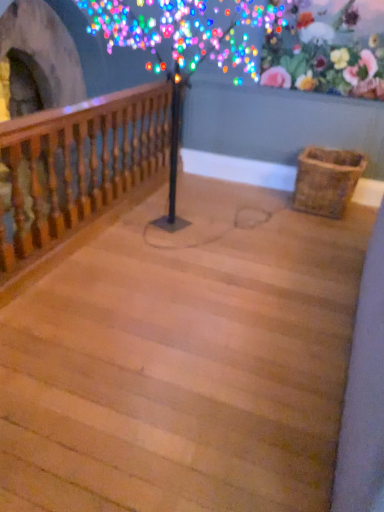
What do you see at coordinates (326, 180) in the screenshot? I see `woven brown basket at lower right` at bounding box center [326, 180].

Describe the element at coordinates (184, 361) in the screenshot. I see `wooden stairs at center` at that location.

What is the approximate height of floral fabric at upper right?

floral fabric at upper right is 70.55 centimeters in height.

This screenshot has width=384, height=512. In order to click on woven brown basket at lower right in this screenshot , I will do `click(326, 180)`.

The height and width of the screenshot is (512, 384). Identify the location of floral arrangement that appears in front of the woven brown basket at lower right. (326, 50).

From a real-world perspective, is woven brown basket at lower right physically above floral fabric at upper right?

No, from a real-world perspective, woven brown basket at lower right is not above floral fabric at upper right.

What's the angular difference between woven brown basket at lower right and floral fabric at upper right's facing directions?

The facing directions of woven brown basket at lower right and floral fabric at upper right are 88.6 degrees apart.

Looking at this image, is woven brown basket at lower right at the left side of floral fabric at upper right?

In fact, woven brown basket at lower right is to the right of floral fabric at upper right.

Would you say woven brown basket at lower right is to the left or to the right of wooden stairs at center in the picture?

In the image, woven brown basket at lower right appears on the right side of wooden stairs at center.

Which of these two, woven brown basket at lower right or wooden stairs at center, stands shorter?

Standing shorter between the two is wooden stairs at center.

Is woven brown basket at lower right oriented away from wooden stairs at center?

No.

How many degrees apart are the facing directions of woven brown basket at lower right and wooden stairs at center?

89.3 degrees.

Is floral fabric at upper right oriented away from wooden baluster at left?

That's not correct — floral fabric at upper right is not looking away from wooden baluster at left.

In terms of height, does floral fabric at upper right look taller or shorter compared to wooden baluster at left?

In the image, floral fabric at upper right appears to be shorter than wooden baluster at left.

The image size is (384, 512). In order to click on rail in front of the floral fabric at upper right in this screenshot , I will do `click(77, 164)`.

From a real-world perspective, is floral fabric at upper right on wooden baluster at left?

Indeed, from a real-world perspective, floral fabric at upper right stands above wooden baluster at left.

Is wooden stairs at center facing towards wooden baluster at left?

No, wooden stairs at center is not oriented towards wooden baluster at left.

Considering the relative sizes of wooden stairs at center and wooden baluster at left in the image provided, is wooden stairs at center taller than wooden baluster at left?

No.

The image size is (384, 512). I want to click on rail positioned vertically above the wooden stairs at center (from a real-world perspective), so click(77, 164).

Considering the relative sizes of floral fabric at upper right and woven brown basket at lower right in the image provided, is floral fabric at upper right smaller than woven brown basket at lower right?

Indeed, floral fabric at upper right has a smaller size compared to woven brown basket at lower right.

From the image's perspective, which is below, floral fabric at upper right or woven brown basket at lower right?

woven brown basket at lower right appears lower in the image.

This screenshot has width=384, height=512. In order to click on basket lying on the right of floral fabric at upper right in this screenshot , I will do `click(326, 180)`.

Is woven brown basket at lower right at the back of floral fabric at upper right?

No, floral fabric at upper right is not facing the opposite direction of woven brown basket at lower right.

Considering the sizes of objects wooden baluster at left and wooden stairs at center in the image provided, who is bigger, wooden baluster at left or wooden stairs at center?

With larger size is wooden stairs at center.

Between wooden baluster at left and wooden stairs at center, which one has smaller width?

With smaller width is wooden baluster at left.

Which is more to the right, wooden baluster at left or wooden stairs at center?

wooden stairs at center is more to the right.

Considering the sizes of objects wooden baluster at left and wooden stairs at center in the image provided, who is taller, wooden baluster at left or wooden stairs at center?

Standing taller between the two is wooden baluster at left.

Considering the relative sizes of wooden baluster at left and woven brown basket at lower right in the image provided, is wooden baluster at left bigger than woven brown basket at lower right?

Yes.

From a real-world perspective, which is physically below, wooden baluster at left or woven brown basket at lower right?

woven brown basket at lower right is physically lower.

Between wooden baluster at left and woven brown basket at lower right, which one appears on the right side from the viewer's perspective?

From the viewer's perspective, woven brown basket at lower right appears more on the right side.

The width and height of the screenshot is (384, 512). Find the location of `rail in front of the woven brown basket at lower right`. rail in front of the woven brown basket at lower right is located at coordinates (77, 164).

Where is `basket located on the right of floral fabric at upper right`? basket located on the right of floral fabric at upper right is located at coordinates (326, 180).

There is a wooden stairs at center. At what (x,y) coordinates should I click in order to perform the action: click on basket above it (from a real-world perspective). Please return your answer as a coordinate pair (x, y). Image resolution: width=384 pixels, height=512 pixels. Looking at the image, I should click on (326, 180).

From the image, which object appears to be farther from wooden stairs at center, floral fabric at upper right or wooden baluster at left?

floral fabric at upper right is positioned further to the anchor wooden stairs at center.

When comparing their distances from wooden baluster at left, does woven brown basket at lower right or wooden stairs at center seem further?

woven brown basket at lower right is further to wooden baluster at left.

Which object lies further to the anchor point wooden stairs at center, woven brown basket at lower right or wooden baluster at left?

The object further to wooden stairs at center is woven brown basket at lower right.

From the image, which object appears to be nearer to wooden stairs at center, wooden baluster at left or woven brown basket at lower right?

wooden baluster at left is closer to wooden stairs at center.

When comparing their distances from woven brown basket at lower right, does wooden baluster at left or floral fabric at upper right seem further?

The object further to woven brown basket at lower right is wooden baluster at left.

Which object lies further to the anchor point floral fabric at upper right, wooden stairs at center or wooden baluster at left?

wooden stairs at center is further to floral fabric at upper right.

From the image, which object appears to be farther from woven brown basket at lower right, floral fabric at upper right or wooden baluster at left?

wooden baluster at left is positioned further to the anchor woven brown basket at lower right.

Estimate the real-world distances between objects in this image. Which object is closer to wooden baluster at left, floral fabric at upper right or woven brown basket at lower right?

floral fabric at upper right is closer to wooden baluster at left.

Where is `floral arrangement positioned between wooden stairs at center and woven brown basket at lower right from near to far`? The width and height of the screenshot is (384, 512). floral arrangement positioned between wooden stairs at center and woven brown basket at lower right from near to far is located at coordinates (326, 50).

At what (x,y) coordinates should I click in order to perform the action: click on rail between wooden stairs at center and woven brown basket at lower right along the z-axis. Please return your answer as a coordinate pair (x, y). This screenshot has width=384, height=512. Looking at the image, I should click on (77, 164).

At what (x,y) coordinates should I click in order to perform the action: click on rail located between wooden stairs at center and floral fabric at upper right in the depth direction. Please return your answer as a coordinate pair (x, y). Looking at the image, I should click on (77, 164).

Where is `floral arrangement located between wooden baluster at left and woven brown basket at lower right in the left-right direction`? floral arrangement located between wooden baluster at left and woven brown basket at lower right in the left-right direction is located at coordinates (326, 50).